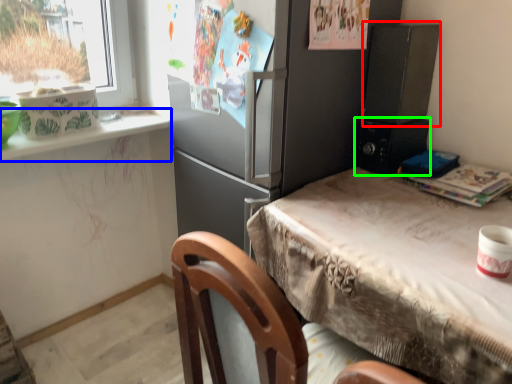
Question: Which object is the closest to the appliance (highlighted by a red box)? Choose among these: window sill (highlighted by a blue box) or appliance (highlighted by a green box).

Choices:
 (A) window sill
 (B) appliance

Answer: (B)